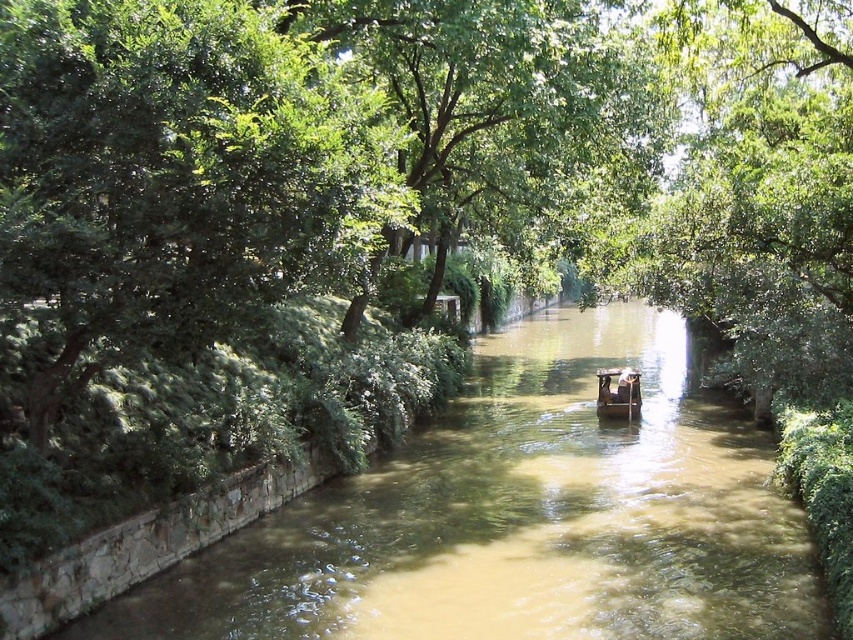
Who is more distant from viewer, (569, 330) or (628, 188)?

The point (569, 330) is behind.

Image resolution: width=853 pixels, height=640 pixels. I want to click on brown muddy water at center, so click(521, 516).

Where is `brown muddy water at center`? The width and height of the screenshot is (853, 640). brown muddy water at center is located at coordinates (521, 516).

Who is positioned more to the right, green leafy tree at left or wooden boat at center?

wooden boat at center is more to the right.

Measure the distance between green leafy tree at left and camera.

The distance of green leafy tree at left from camera is 6.76 meters.

Locate an element on the screen. This screenshot has height=640, width=853. green leafy tree at left is located at coordinates (177, 173).

In the scene shown: Is brown muddy water at center taller than green leafy tree at left?

No, brown muddy water at center is not taller than green leafy tree at left.

At what (x,y) coordinates should I click in order to perform the action: click on brown muddy water at center. Please return your answer as a coordinate pair (x, y). This screenshot has width=853, height=640. Looking at the image, I should click on pyautogui.click(x=521, y=516).